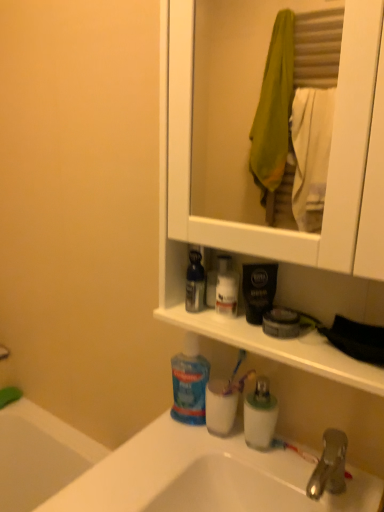
Describe the element at coordinates (220, 406) in the screenshot. I see `translucent plastic mouthwash at sink, arranged as the second mouthwash when viewed from the left` at that location.

The height and width of the screenshot is (512, 384). Describe the element at coordinates (189, 383) in the screenshot. I see `blue translucent mouthwash at center` at that location.

How much space does translucent plastic soap dispenser at lower center, the 2th toiletry when ordered from top to bottom, occupy horizontally?

2.59 inches.

In order to face blue glossy mouthwash at center, acting as the 2th mouthwash starting from the bottom, should I rotate leftwards or rightwards?

You should rotate right by 0.524 degrees.

The width and height of the screenshot is (384, 512). What are the coordinates of `blue glossy mouthwash at center, the second mouthwash viewed from the right` in the screenshot? It's located at (195, 283).

Identify the location of translucent plastic toothbrush at lower center. Image resolution: width=384 pixels, height=512 pixels. (235, 371).

How much space does white glossy lotion at center, which ranks as the first toiletry in top-to-bottom order, occupy vertically?

The height of white glossy lotion at center, which ranks as the first toiletry in top-to-bottom order, is 5.42 inches.

Find the location of a particular element. Image resolution: width=384 pixels, height=512 pixels. white matte cabinet at upper center is located at coordinates (256, 225).

At what (x,y) coordinates should I click in order to perform the action: click on translucent plastic mouthwash at sink, the 1th mouthwash from the right. Please return your answer as a coordinate pair (x, y). The width and height of the screenshot is (384, 512). Looking at the image, I should click on (220, 406).

Can you confirm if blue translucent mouthwash at center is thinner than white glossy lotion at center, which ranks as the first toiletry in top-to-bottom order?

Incorrect, the width of blue translucent mouthwash at center is not less than that of white glossy lotion at center, which ranks as the first toiletry in top-to-bottom order.

Between blue translucent mouthwash at center and white glossy lotion at center, the second toiletry ordered from the bottom, which one is positioned in front?

white glossy lotion at center, the second toiletry ordered from the bottom, is closer to the camera.

From a real-world perspective, which is physically below, blue translucent mouthwash at center or white glossy lotion at center, which ranks as the first toiletry in top-to-bottom order?

Result: From a 3D spatial view, blue translucent mouthwash at center is below.

Measure the distance from blue translucent mouthwash at center to white glossy lotion at center, which is counted as the 1th toiletry, starting from the left.

A distance of 8.24 inches exists between blue translucent mouthwash at center and white glossy lotion at center, which is counted as the 1th toiletry, starting from the left.

Is point (242, 319) farther from camera compared to point (195, 290)?

No.

From the picture: Which of these two, white matte cabinet at upper center or blue glossy mouthwash at center, the second mouthwash viewed from the right, is bigger?

white matte cabinet at upper center is bigger.

From the image's perspective, does white matte cabinet at upper center appear lower than blue glossy mouthwash at center, the second mouthwash viewed from the right?

Incorrect, from the image's perspective, white matte cabinet at upper center is higher than blue glossy mouthwash at center, the second mouthwash viewed from the right.

From the picture: From a real-world perspective, relative to blue glossy mouthwash at center, placed as the first mouthwash when sorted from left to right, is white matte cabinet at upper center vertically above or below?

white matte cabinet at upper center is situated higher than blue glossy mouthwash at center, placed as the first mouthwash when sorted from left to right, in the real world.

Does white matte cabinet at upper center lie in front of white glossy lotion at center, the 2th toiletry from the right?

Yes, the depth of white matte cabinet at upper center is less than that of white glossy lotion at center, the 2th toiletry from the right.

I want to click on cabinetry above the white glossy lotion at center, which is counted as the 1th toiletry, starting from the left (from a real-world perspective), so click(x=256, y=225).

Is there a large distance between white matte cabinet at upper center and white glossy lotion at center, which ranks as the first toiletry in top-to-bottom order?

No.

Measure the distance from blue translucent mouthwash at center to translucent plastic mouthwash at sink, the 1th mouthwash from the right.

2.10 inches.

Is blue translucent mouthwash at center aimed at translucent plastic mouthwash at sink, acting as the 2th mouthwash starting from the top?

No, blue translucent mouthwash at center is not aimed at translucent plastic mouthwash at sink, acting as the 2th mouthwash starting from the top.

What's the angular difference between blue translucent mouthwash at center and translucent plastic mouthwash at sink, the 1th mouthwash from the right,'s facing directions?

0.963 degrees.

Find the location of a particular element. the 2nd mouthwash to the right of the blue translucent mouthwash at center, counting from the anchor's position is located at coordinates (220, 406).

Is point (241, 358) more distant than point (207, 404)?

Yes.

Is translucent plastic toothbrush at lower center positioned beyond the bounds of translucent plastic mouthwash at sink, acting as the 2th mouthwash starting from the top?

Yes, translucent plastic toothbrush at lower center is located beyond the bounds of translucent plastic mouthwash at sink, acting as the 2th mouthwash starting from the top.

Is translucent plastic toothbrush at lower center not near translucent plastic mouthwash at sink, the 1th mouthwash from the right?

No.

From the image's perspective, would you say translucent plastic toothbrush at lower center is positioned over translucent plastic mouthwash at sink, acting as the 2th mouthwash starting from the top?

Yes.

In the scene shown: Does white glossy lotion at center, which is counted as the 1th toiletry, starting from the left, lie in front of blue translucent mouthwash at center?

Yes, white glossy lotion at center, which is counted as the 1th toiletry, starting from the left, is closer to the camera.

Does white glossy lotion at center, the second toiletry ordered from the bottom, appear on the left side of blue translucent mouthwash at center?

No, white glossy lotion at center, the second toiletry ordered from the bottom, is not to the left of blue translucent mouthwash at center.

Is blue translucent mouthwash at center a part of white glossy lotion at center, which ranks as the first toiletry in top-to-bottom order?

Definitely not — blue translucent mouthwash at center is not inside white glossy lotion at center, which ranks as the first toiletry in top-to-bottom order.

Which object is more forward, white matte cabinet at upper center or blue translucent mouthwash at center?

Positioned in front is white matte cabinet at upper center.

Considering the sizes of objects white matte cabinet at upper center and blue translucent mouthwash at center in the image provided, who is shorter, white matte cabinet at upper center or blue translucent mouthwash at center?

Standing shorter between the two is blue translucent mouthwash at center.

From a real-world perspective, is white matte cabinet at upper center physically above blue translucent mouthwash at center?

Yes.

Is white matte cabinet at upper center oriented towards blue translucent mouthwash at center?

No, white matte cabinet at upper center is not aimed at blue translucent mouthwash at center.

The image size is (384, 512). Identify the location of cleaning product behind the white glossy lotion at center, the second toiletry ordered from the bottom. (189, 383).

Find the location of `mouthwash that is the 1st object directly below the white matte cabinet at upper center (from a real-world perspective)`. mouthwash that is the 1st object directly below the white matte cabinet at upper center (from a real-world perspective) is located at coordinates (195, 283).

Estimate the real-world distances between objects in this image. Which object is further from white glossy lotion at center, the second toiletry ordered from the bottom, blue translucent mouthwash at center or translucent plastic toothbrush at lower center?

The object further to white glossy lotion at center, the second toiletry ordered from the bottom, is blue translucent mouthwash at center.

Estimate the real-world distances between objects in this image. Which object is closer to translucent plastic toothbrush at lower center, translucent plastic mouthwash at sink, arranged as the second mouthwash when viewed from the left, or white matte cabinet at upper center?

translucent plastic mouthwash at sink, arranged as the second mouthwash when viewed from the left.

Which object lies further to the anchor point blue glossy mouthwash at center, placed as the first mouthwash when sorted from left to right, translucent plastic mouthwash at sink, which is the 1th mouthwash in bottom-to-top order, or blue translucent mouthwash at center?

translucent plastic mouthwash at sink, which is the 1th mouthwash in bottom-to-top order, is positioned further to the anchor blue glossy mouthwash at center, placed as the first mouthwash when sorted from left to right.

Considering their positions, is blue glossy mouthwash at center, the second mouthwash viewed from the right, positioned closer to white matte cabinet at upper center than blue translucent mouthwash at center?

Based on the image, blue glossy mouthwash at center, the second mouthwash viewed from the right, appears to be nearer to white matte cabinet at upper center.

Considering their positions, is blue glossy mouthwash at center, the second mouthwash viewed from the right, positioned further to white matte cabinet at upper center than translucent plastic mouthwash at sink, acting as the 2th mouthwash starting from the top?

translucent plastic mouthwash at sink, acting as the 2th mouthwash starting from the top.

Which object lies further to the anchor point translucent plastic soap dispenser at lower center, the 2th toiletry when ordered from top to bottom, white matte cabinet at upper center or blue translucent mouthwash at center?

white matte cabinet at upper center is further to translucent plastic soap dispenser at lower center, the 2th toiletry when ordered from top to bottom.

Looking at the image, which one is located closer to blue glossy mouthwash at center, the second mouthwash viewed from the right, translucent plastic mouthwash at sink, acting as the 2th mouthwash starting from the top, or white matte cabinet at upper center?

white matte cabinet at upper center lies closer to blue glossy mouthwash at center, the second mouthwash viewed from the right, than the other object.

Which object lies further to the anchor point translucent plastic soap dispenser at lower center, the 2th toiletry when ordered from top to bottom, white glossy lotion at center, the 2th toiletry from the right, or translucent plastic mouthwash at sink, the 1th mouthwash from the right?

white glossy lotion at center, the 2th toiletry from the right, is positioned further to the anchor translucent plastic soap dispenser at lower center, the 2th toiletry when ordered from top to bottom.

You are a GUI agent. You are given a task and a screenshot of the screen. Output one action in this format:
    pyautogui.click(x=<x>, y=<y>)
    Task: Click on the cleaning product between white matte cabinet at upper center and translucent plastic mouthwash at sink, the 1th mouthwash from the right, in the vertical direction
    The height and width of the screenshot is (512, 384).
    Given the screenshot: What is the action you would take?
    pyautogui.click(x=189, y=383)

The image size is (384, 512). I want to click on toothbrush between blue glossy mouthwash at center, acting as the 2th mouthwash starting from the bottom, and translucent plastic soap dispenser at lower center, marked as the second toiletry in a left-to-right arrangement, in the up-down direction, so click(235, 371).

This screenshot has height=512, width=384. Find the location of `toiletry between white matte cabinet at upper center and translucent plastic soap dispenser at lower center, the first toiletry from the bottom, in the up-down direction`. toiletry between white matte cabinet at upper center and translucent plastic soap dispenser at lower center, the first toiletry from the bottom, in the up-down direction is located at coordinates point(216,278).

This screenshot has width=384, height=512. Identify the location of cleaning product between white matte cabinet at upper center and translucent plastic toothbrush at lower center from front to back. (189, 383).